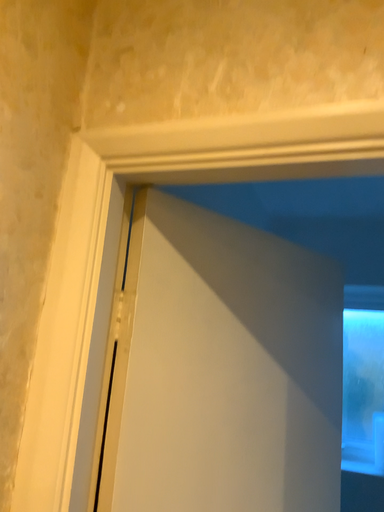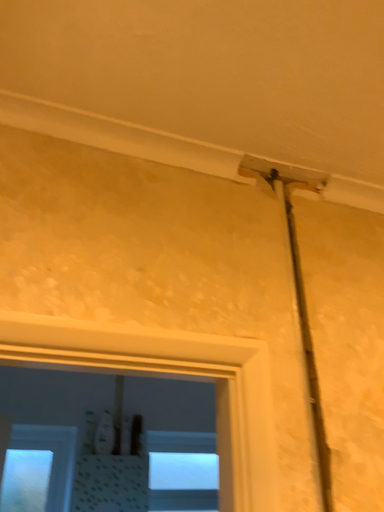
Question: Which way did the camera rotate in the video?

Choices:
 (A) rotated upward
 (B) rotated downward

Answer: (A)